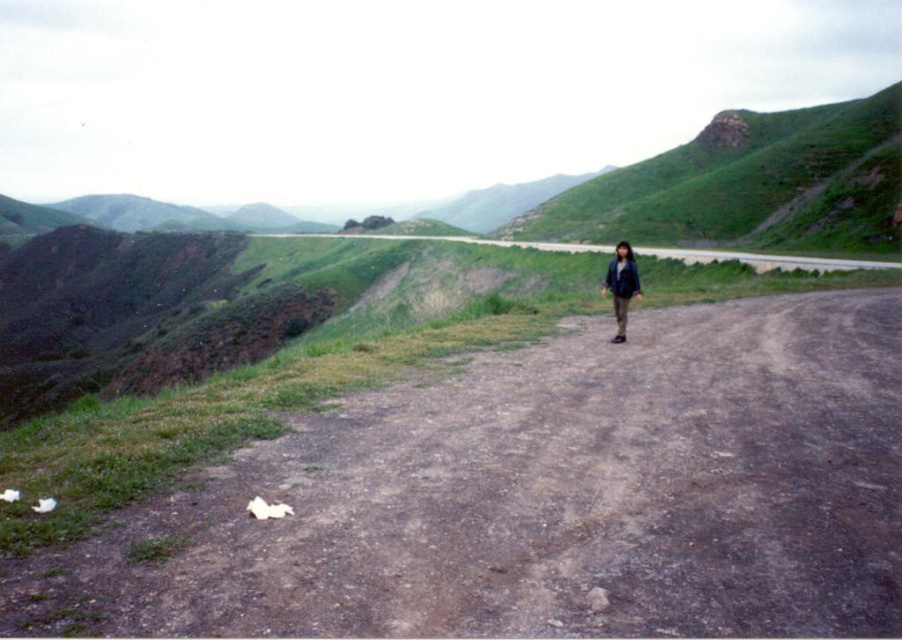
Can you confirm if dull brown dirt track at center is positioned below dark blue jacket at center?

Correct, dull brown dirt track at center is located below dark blue jacket at center.

Is dull brown dirt track at center bigger than dark blue jacket at center?

No.

Is point (608, 604) in front of point (627, 260)?

That is True.

At what (x,y) coordinates should I click in order to perform the action: click on dull brown dirt track at center. Please return your answer as a coordinate pair (x, y). Looking at the image, I should click on (546, 497).